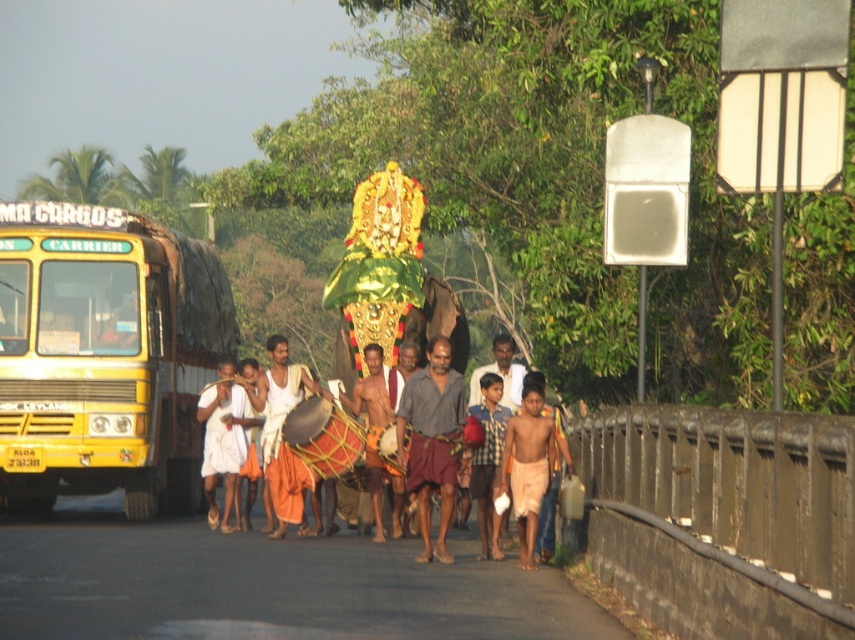
You are a photographer positioned at the front of the procession. You want to take a photo that includes both the gray cotton shirt at center and the white cotton cloth at center. Based on their positions, which object should you focus on first to ensure both are in frame?

The gray cotton shirt at center is to the right of the white cotton cloth at center. To include both in the frame, focus on the white cotton cloth at center first as it is on the left, then adjust to include the gray cotton shirt at center on the right.

From the picture: You are a photographer trying to capture the entire scene of the cultural procession. You notice the yellow matte school bus at left and the checkered fabric shirt at center. Which object should you focus on to ensure the widest possible shot without cropping either object?

The yellow matte school bus at left is wider than the checkered fabric shirt at center, so focusing on it will allow you to capture the widest shot without cropping either object.